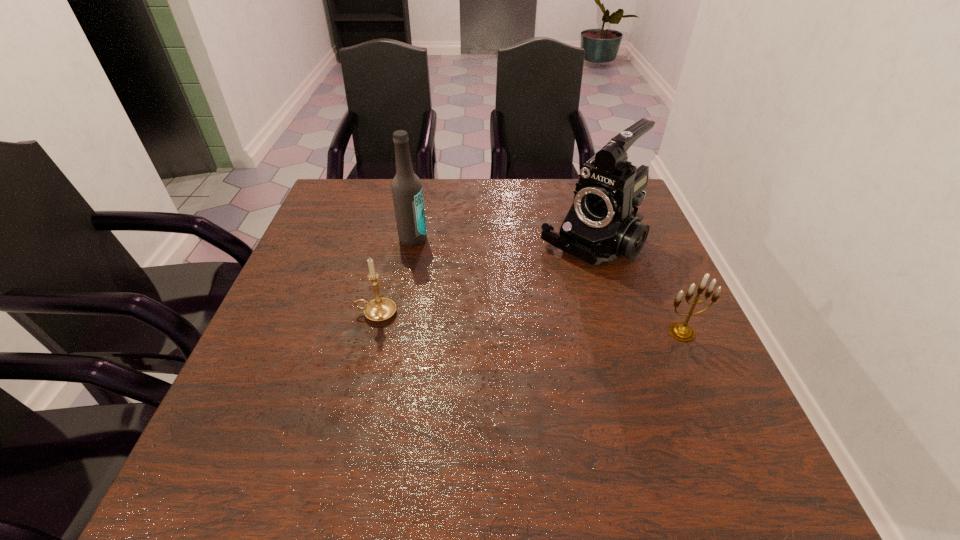
Find the location of a particular element. This screenshot has height=540, width=960. unoccupied position between the right candelabrum and the left candelabrum is located at coordinates (529, 323).

Identify the location of vacant point located between the camcorder and the left candelabrum. Image resolution: width=960 pixels, height=540 pixels. click(x=483, y=279).

Where is `empty space between the beer bottle and the left candelabrum`? The image size is (960, 540). empty space between the beer bottle and the left candelabrum is located at coordinates (395, 276).

The height and width of the screenshot is (540, 960). I want to click on object that stands as the second closest to the beer bottle, so click(600, 226).

Point out which object is positioned as the nearest to the camcorder. Please provide its 2D coordinates. Your answer should be formatted as a tuple, i.e. [(x, y)], where the tuple contains the x and y coordinates of a point satisfying the conditions above.

[(683, 332)]